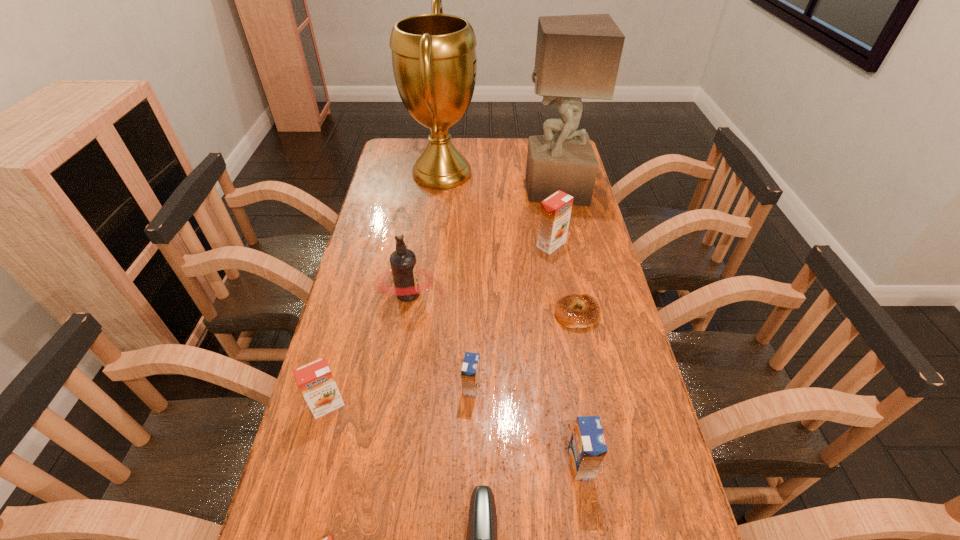
In the image, there is a desktop. Where is `vacant space at the left edge`? The width and height of the screenshot is (960, 540). vacant space at the left edge is located at coordinates (352, 365).

In the image, there is a desktop. Where is `free space at the right edge`? The width and height of the screenshot is (960, 540). free space at the right edge is located at coordinates (x=588, y=207).

Locate an element on the screen. The width and height of the screenshot is (960, 540). free space at the far left corner of the desktop is located at coordinates (401, 143).

The image size is (960, 540). I want to click on free space between the third tallest object and the gray sculpture, so click(x=482, y=241).

I want to click on blank region between the leftmost orange juice and the tan bagel, so click(452, 359).

This screenshot has width=960, height=540. I want to click on empty space that is in between the tallest orange juice and the leftmost orange juice, so click(440, 325).

Locate an element on the screen. This screenshot has width=960, height=540. free point between the nearer blue orange_juice and the second nearest orange orange juice is located at coordinates (454, 435).

The height and width of the screenshot is (540, 960). What are the coordinates of `free space between the right blue orange_juice and the trophy cup` in the screenshot? It's located at (512, 319).

Where is `free space between the third tallest object and the farthest orange juice`? This screenshot has height=540, width=960. free space between the third tallest object and the farthest orange juice is located at coordinates (480, 269).

Where is `unoccupied position between the root beer and the second farthest orange orange juice`? unoccupied position between the root beer and the second farthest orange orange juice is located at coordinates (369, 349).